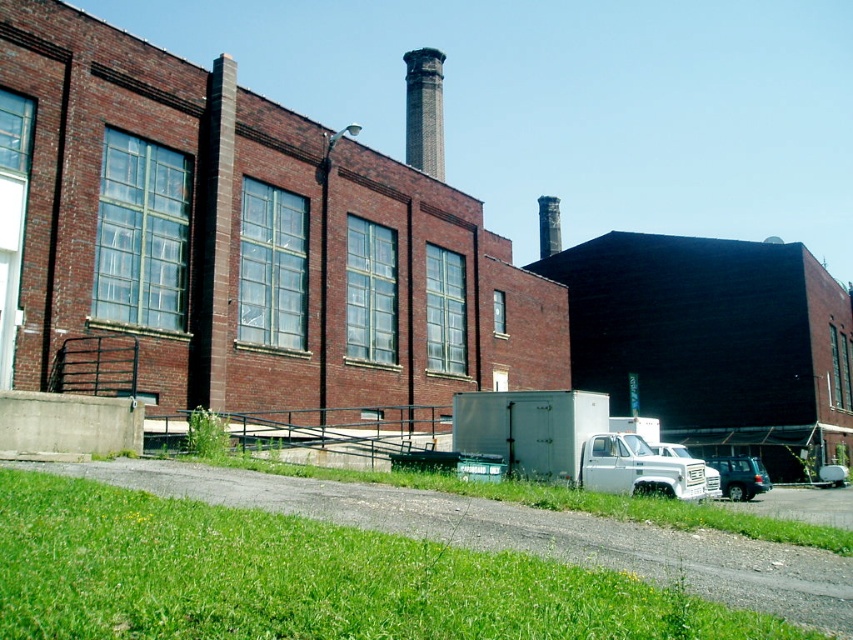
Question: Estimate the real-world distances between objects in this image. Which object is farther from the dark gray stone chimney at upper center?

Choices:
 (A) white matte truck at lower right
 (B) brick at center
 (C) white matte truck at center
 (D) matte gray suv at lower right

Answer: (C)

Question: Is white matte truck at lower right below dark gray stone chimney at upper center?

Choices:
 (A) yes
 (B) no

Answer: (A)

Question: Is white matte truck at lower right above white matte truck at center?

Choices:
 (A) no
 (B) yes

Answer: (B)

Question: Based on their relative distances, which object is farther from the white metallic truck at lower right?

Choices:
 (A) brick at center
 (B) dark gray stone chimney at upper center
 (C) white matte truck at center
 (D) matte gray suv at lower right

Answer: (B)

Question: Which point appears farthest from the camera in this image?

Choices:
 (A) (53, 129)
 (B) (648, 454)
 (C) (660, 445)
 (D) (508, 426)

Answer: (C)

Question: Does white matte truck at center come behind white metallic truck at lower right?

Choices:
 (A) yes
 (B) no

Answer: (B)